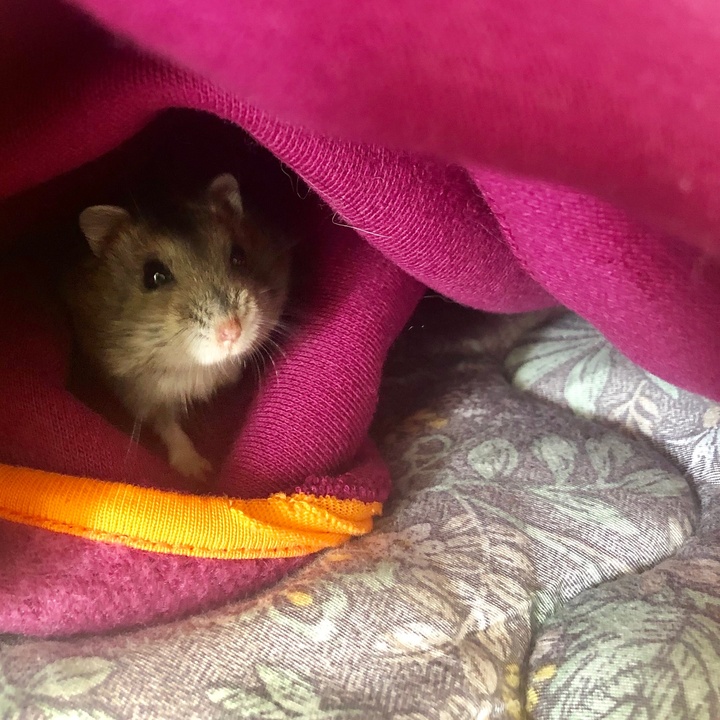
Locate an element on the screen. The height and width of the screenshot is (720, 720). curve in mattress is located at coordinates (697, 507).